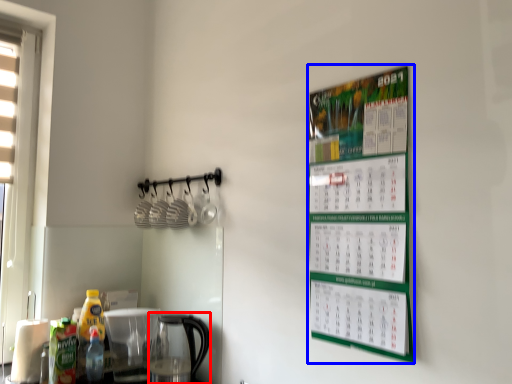
Question: Which point is closer to the camera, coffeepot (highlighted by a red box) or bulletin board (highlighted by a blue box)?

Choices:
 (A) coffeepot
 (B) bulletin board

Answer: (B)